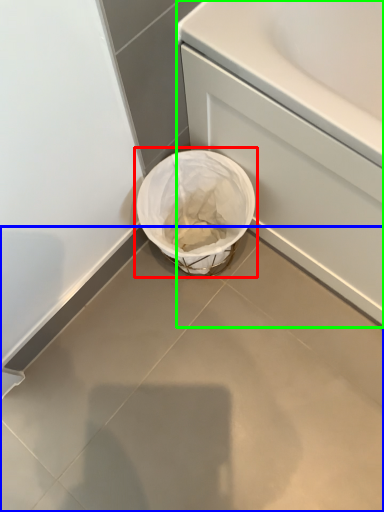
Question: Considering the real-world distances, which object is farthest from waste container (highlighted by a red box)? concrete (highlighted by a blue box) or bath (highlighted by a green box)?

Choices:
 (A) concrete
 (B) bath

Answer: (A)